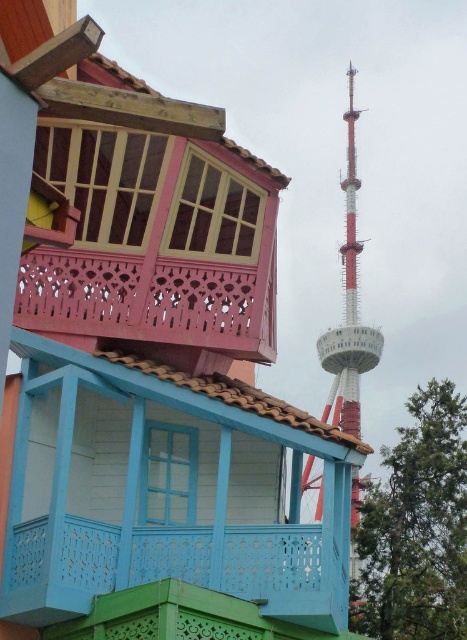
You are a painter standing at the base of the building and need to paint both the blue painted wood balcony at center and the pink woodwork balcony at upper left. Given that your ladder can reach up to 9 meters, will you be able to reach both balconies from your current position?

The blue painted wood balcony at center is 8.64 meters from the pink woodwork balcony at upper left. Since the ladder can reach up to 9 meters, you can reach both balconies from your current position as the distance between them is within the ladder reach.

You are standing on the ground floor of the building and looking up at the pink woodwork balcony at upper left and the red and white painted tower at upper right. Which object is closer to the ground floor?

The pink woodwork balcony at upper left is closer to the ground floor because it is positioned under the red and white painted tower at upper right, meaning the tower is higher up.

You are standing in front of the building and want to take a photo of both the blue painted wood balcony at center and the pink woodwork balcony at upper left. Which balcony will appear larger in your photo?

The blue painted wood balcony at center will appear larger in the photo because it is closer to the viewer than the pink woodwork balcony at upper left.